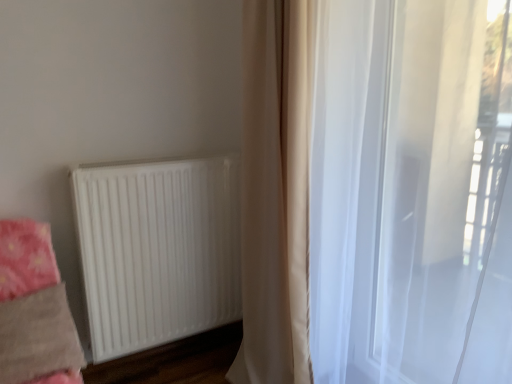
Question: Visually, is translucent white curtain at right, acting as the 2th curtain starting from the left, positioned to the left or to the right of beige fabric curtain at center, which appears as the second curtain when viewed from the right?

Choices:
 (A) right
 (B) left

Answer: (A)

Question: From a real-world perspective, relative to beige fabric curtain at center, which appears as the second curtain when viewed from the right, is translucent white curtain at right, acting as the 2th curtain starting from the left, vertically above or below?

Choices:
 (A) above
 (B) below

Answer: (B)

Question: Which object is positioned farthest from the fluffy pink blanket at lower left?

Choices:
 (A) white matte radiator at lower left
 (B) beige fabric curtain at center, placed as the 1th curtain when sorted from left to right
 (C) translucent white curtain at right, which is counted as the first curtain, starting from the right

Answer: (C)

Question: Which object is the farthest from the fluffy pink blanket at lower left?

Choices:
 (A) white matte radiator at lower left
 (B) beige fabric curtain at center, placed as the 1th curtain when sorted from left to right
 (C) translucent white curtain at right, acting as the 2th curtain starting from the left

Answer: (C)